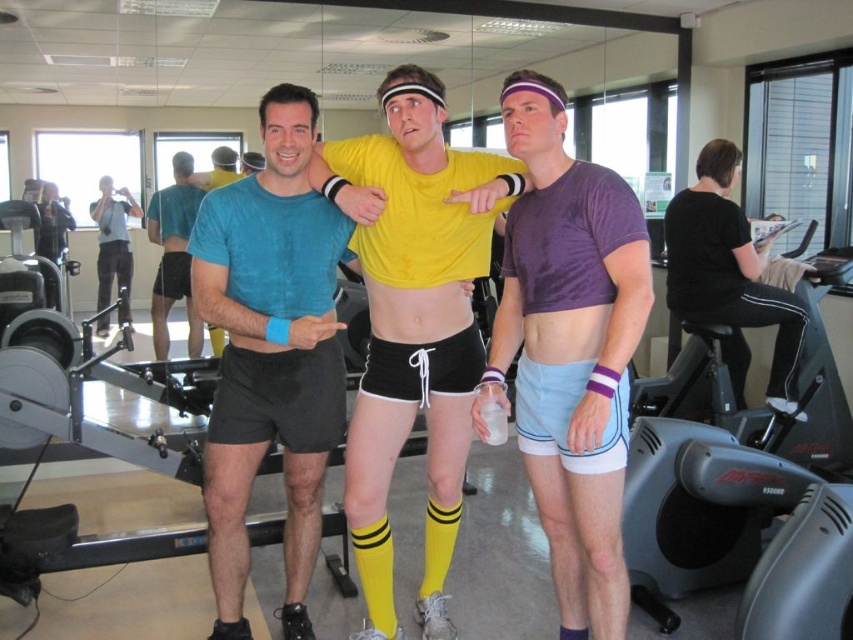
Can you confirm if black matte shorts at center is positioned below skinny white muscle at center?

Actually, black matte shorts at center is above skinny white muscle at center.

Is black matte shorts at center shorter than skinny white muscle at center?

No, black matte shorts at center is not shorter than skinny white muscle at center.

Who is more distant from viewer, (700,225) or (413,337)?

Point (700,225)

Identify the location of black matte shorts at center. (729, 275).

Does purple matte t-shirt at center appear over matte blue shorts at center?

Incorrect, purple matte t-shirt at center is not positioned above matte blue shorts at center.

Looking at this image, is purple matte t-shirt at center smaller than matte blue shorts at center?

Indeed, purple matte t-shirt at center has a smaller size compared to matte blue shorts at center.

Is point (552, 193) farther from camera compared to point (173, 289)?

No, it is in front of (173, 289).

Find the location of a particular element. This screenshot has height=640, width=853. purple matte t-shirt at center is located at coordinates (572, 349).

Is yellow matte shorts at center positioned behind yellow rubber socks at center?

No, it is not.

Can you confirm if yellow matte shorts at center is thinner than yellow rubber socks at center?

Incorrect, yellow matte shorts at center's width is not less than yellow rubber socks at center's.

Between point (392, 312) and point (218, 157), which one is positioned in front?

Positioned in front is point (392, 312).

I want to click on yellow matte shorts at center, so click(x=413, y=323).